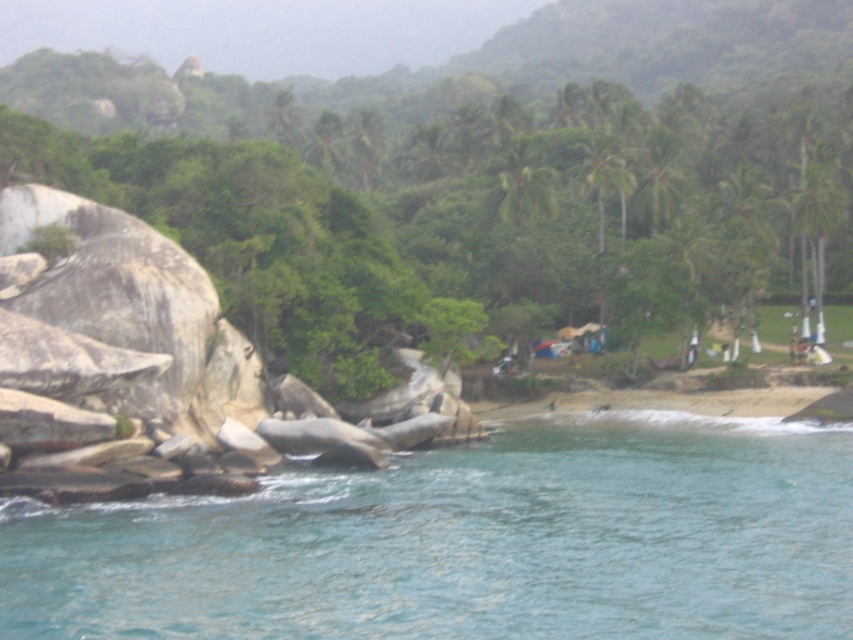
Question: Is clear blue water at lower left smaller than green leafy palm tree at upper center?

Choices:
 (A) yes
 (B) no

Answer: (A)

Question: Estimate the real-world distances between objects in this image. Which object is closer to the green leafy palm tree at upper right?

Choices:
 (A) clear blue water at lower left
 (B) green leafy palm tree at upper center

Answer: (B)

Question: Is green leafy palm tree at upper right above green leafy palm tree at upper center?

Choices:
 (A) no
 (B) yes

Answer: (A)

Question: Which point is farther to the camera?

Choices:
 (A) clear blue water at lower left
 (B) green leafy palm tree at upper right
 (C) green leafy palm tree at upper center

Answer: (C)

Question: Can you confirm if clear blue water at lower left is smaller than green leafy palm tree at upper center?

Choices:
 (A) yes
 (B) no

Answer: (A)

Question: Which of the following is the closest to the observer?

Choices:
 (A) (807, 513)
 (B) (821, 188)

Answer: (A)